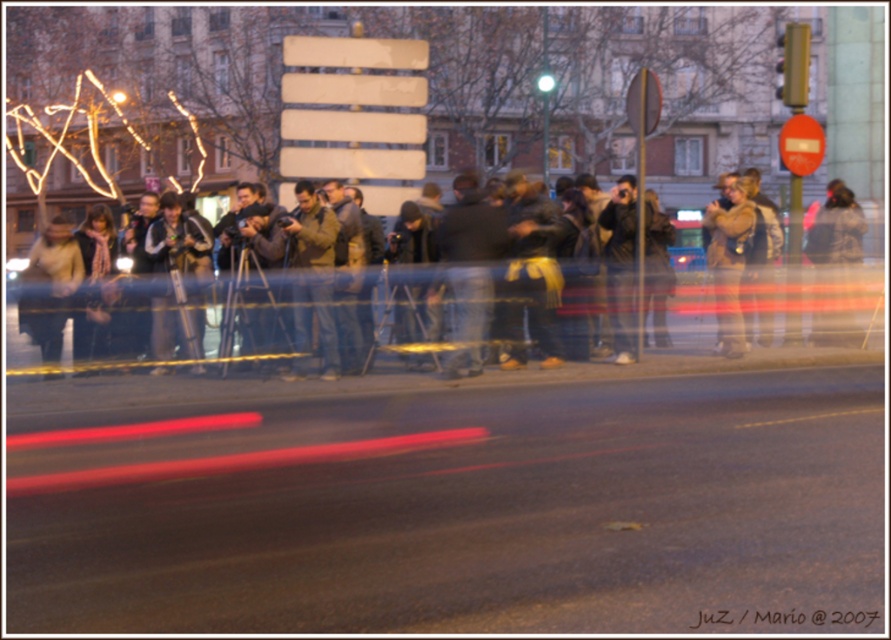
Question: Which object is closer to the camera taking this photo?

Choices:
 (A) brown leather jacket at right
 (B) dark brown jacket at center

Answer: (B)

Question: Does dark brown jacket at center appear under brown leather jacket at right?

Choices:
 (A) no
 (B) yes

Answer: (A)

Question: Does dark brown jacket at center appear on the left side of brown leather jacket at right?

Choices:
 (A) no
 (B) yes

Answer: (A)

Question: Can you confirm if dark brown jacket at center is positioned to the right of brown leather jacket at right?

Choices:
 (A) yes
 (B) no

Answer: (A)

Question: Which object appears farthest from the camera in this image?

Choices:
 (A) dark brown jacket at center
 (B) brown leather jacket at right

Answer: (B)